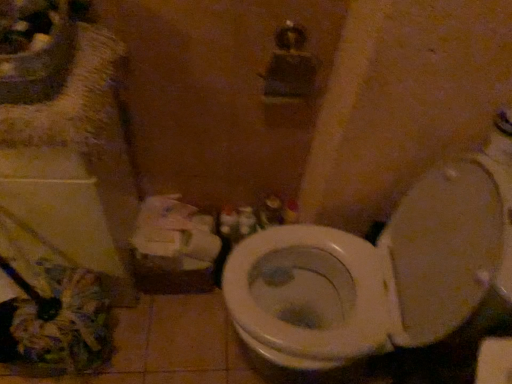
Question: From a real-world perspective, does matte white sink at upper left sit lower than white plastic container at center?

Choices:
 (A) no
 (B) yes

Answer: (A)

Question: Can you confirm if matte white sink at upper left is taller than white plastic container at center?

Choices:
 (A) no
 (B) yes

Answer: (A)

Question: From the image's perspective, is matte white sink at upper left over white plastic container at center?

Choices:
 (A) no
 (B) yes

Answer: (B)

Question: Does matte white sink at upper left have a lesser height compared to white plastic container at center?

Choices:
 (A) yes
 (B) no

Answer: (A)

Question: Is matte white sink at upper left in front of white plastic container at center?

Choices:
 (A) no
 (B) yes

Answer: (B)

Question: Do you think white glossy toilet at center is within white matte toilet paper at lower left, or outside of it?

Choices:
 (A) inside
 (B) outside

Answer: (B)

Question: Considering the positions of white glossy toilet at center and white matte toilet paper at lower left in the image, is white glossy toilet at center taller or shorter than white matte toilet paper at lower left?

Choices:
 (A) tall
 (B) short

Answer: (A)

Question: Considering the positions of white glossy toilet at center and white matte toilet paper at lower left in the image, is white glossy toilet at center wider or thinner than white matte toilet paper at lower left?

Choices:
 (A) wide
 (B) thin

Answer: (A)

Question: Is white glossy toilet at center bigger or smaller than white matte toilet paper at lower left?

Choices:
 (A) small
 (B) big

Answer: (B)

Question: Is point (184, 215) closer or farther from the camera than point (318, 342)?

Choices:
 (A) farther
 (B) closer

Answer: (A)

Question: Is white matte toilet paper at lower left spatially inside white glossy toilet at center, or outside of it?

Choices:
 (A) inside
 (B) outside

Answer: (B)

Question: Is white matte toilet paper at lower left wider or thinner than white glossy toilet at center?

Choices:
 (A) thin
 (B) wide

Answer: (A)

Question: Is white matte toilet paper at lower left to the left or to the right of white glossy toilet at center in the image?

Choices:
 (A) left
 (B) right

Answer: (A)

Question: Does point (10, 16) appear closer or farther from the camera than point (145, 233)?

Choices:
 (A) closer
 (B) farther

Answer: (A)

Question: Visually, is matte white sink at upper left positioned to the left or to the right of white matte toilet paper at lower left?

Choices:
 (A) left
 (B) right

Answer: (A)